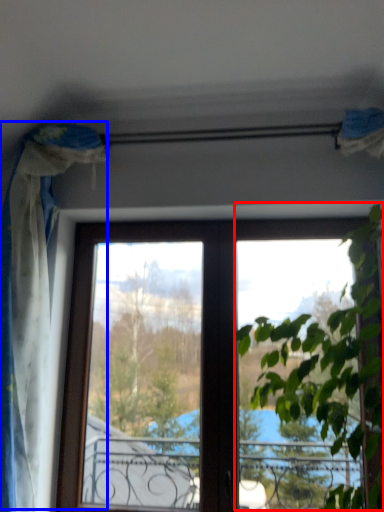
Question: Among these objects, which one is nearest to the camera, vegetation (highlighted by a red box) or curtain (highlighted by a blue box)?

Choices:
 (A) vegetation
 (B) curtain

Answer: (A)